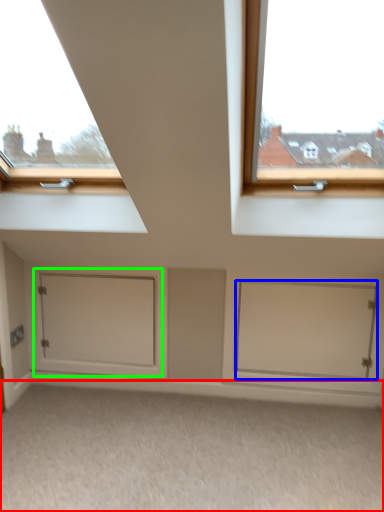
Question: Considering the real-world distances, which object is closest to plain (highlighted by a red box)? door (highlighted by a blue box) or door (highlighted by a green box).

Choices:
 (A) door
 (B) door

Answer: (A)